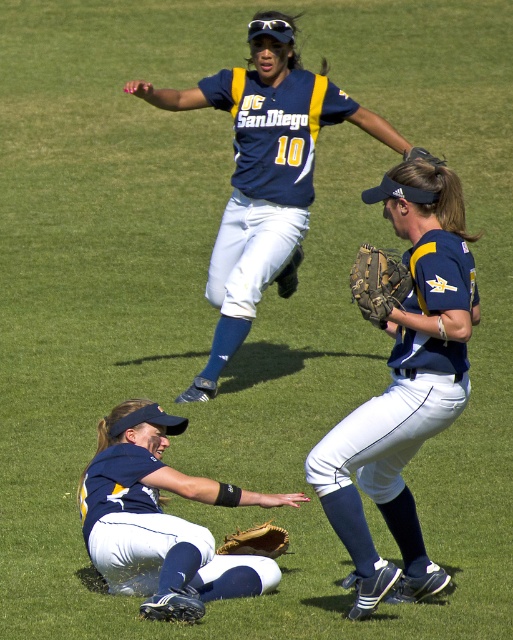
You are a spectator at the softball game. You notice the navy blue jersey at upper center and the brown leather glove at lower center. Which object is located higher in the image?

The navy blue jersey at upper center is positioned higher in the image than the brown leather glove at lower center.

You are a spectator at the softball game and want to know if the matte blue glove at lower left can fit inside the navy blue jersey at upper center. Based on their widths, can it fit?

The matte blue glove at lower left might be wider than navy blue jersey at upper center, so it may not fit inside the navy blue jersey at upper center due to its potential wider width.

You are a sports analyst reviewing the game footage. You need to determine the exact location of the matte blue jersey at upper center on the field. According to the coordinate system where the bottom left corner is the origin, what are its coordinates?

The matte blue jersey at upper center is located at coordinates point (265, 173).